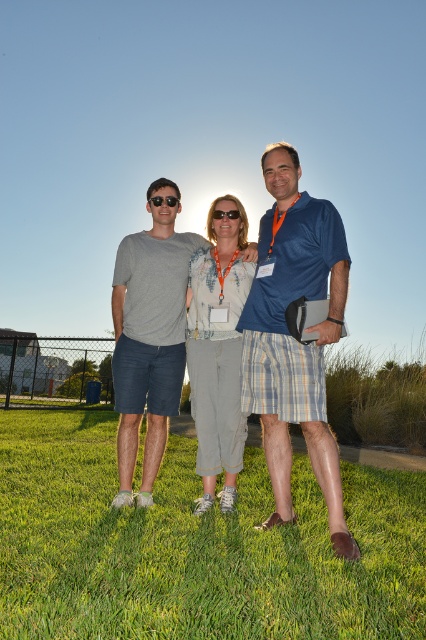
You are a photographer trying to capture the three people in the scene. You notice that the person wearing the matte gray t shirt at center is standing at point (296,337). Where should you position your camera to ensure that all three individuals are in frame?

The matte gray t shirt at center is located at point (296,337). To include all three individuals in the frame, position the camera centrally so that the matte gray t shirt at center is at the focal point, ensuring the other two are within the camera view.